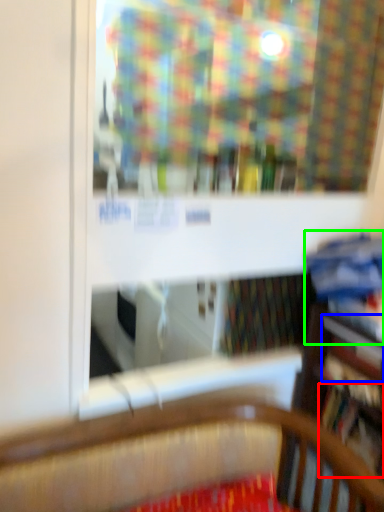
Question: Based on their relative distances, which object is farther from book (highlighted by a red box)? Choose from book (highlighted by a blue box) and book (highlighted by a green box).

Choices:
 (A) book
 (B) book

Answer: (B)